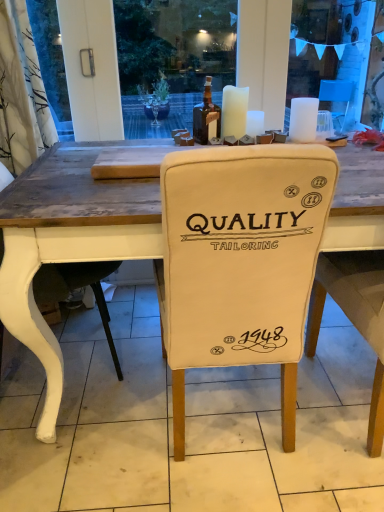
Question: Is point (238, 113) closer or farther from the camera than point (72, 239)?

Choices:
 (A) closer
 (B) farther

Answer: (B)

Question: Looking at their shapes, would you say white matte candle at upper center, the 3th candle when ordered from right to left, is wider or thinner than white fabric chair at center?

Choices:
 (A) wide
 (B) thin

Answer: (B)

Question: Estimate the real-world distances between objects in this image. Which object is farther from the white wax candle at center, acting as the second candle starting from the right?

Choices:
 (A) white matte candle at upper center, acting as the 3th candle starting from the left
 (B) white fabric chair at center
 (C) white fabric chair at left
 (D) brown glass bottle at upper center
 (E) white matte candle at upper center, the 3th candle when ordered from right to left

Answer: (C)

Question: Which of these objects is positioned farthest from the white wax candle at center, the 2th candle in the left-to-right sequence?

Choices:
 (A) white matte candle at upper center, the 3th candle when ordered from right to left
 (B) brown glass bottle at upper center
 (C) white fabric chair at center
 (D) white matte candle at upper center, which appears as the 1th candle when viewed from the right
 (E) white fabric chair cover at center

Answer: (E)